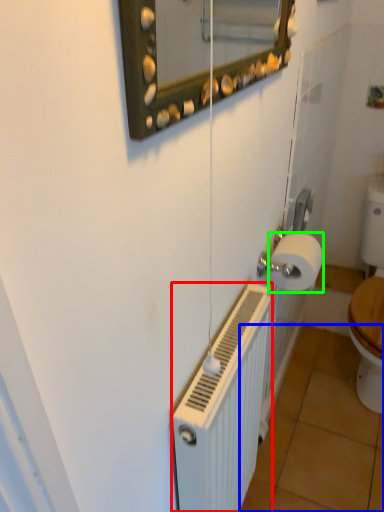
Question: Estimate the real-world distances between objects in this image. Which object is farther from radiator (highlighted by a red box), tile (highlighted by a blue box) or toilet paper (highlighted by a green box)?

Choices:
 (A) tile
 (B) toilet paper

Answer: (A)